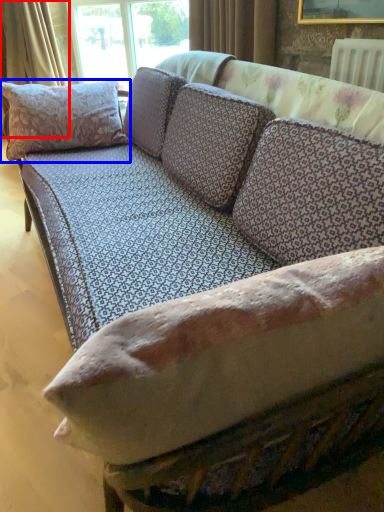
Question: Among these objects, which one is nearest to the camera, curtain (highlighted by a red box) or pillow (highlighted by a blue box)?

Choices:
 (A) curtain
 (B) pillow

Answer: (B)